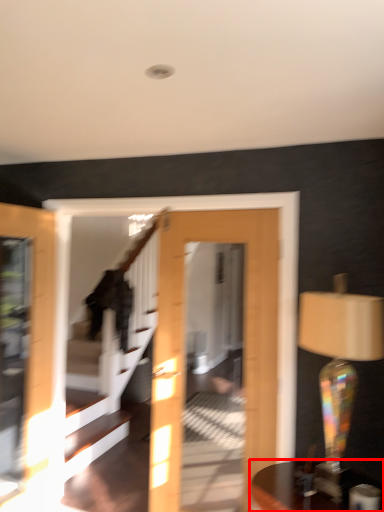
Question: Observing the image, what is the correct spatial positioning of table (annotated by the red box) in reference to table lamp?

Choices:
 (A) right
 (B) left

Answer: (B)